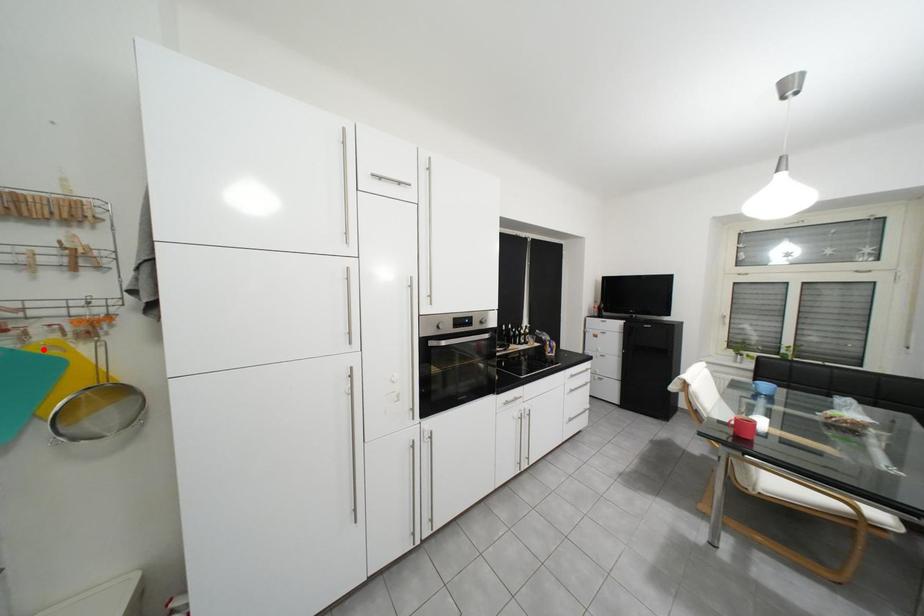
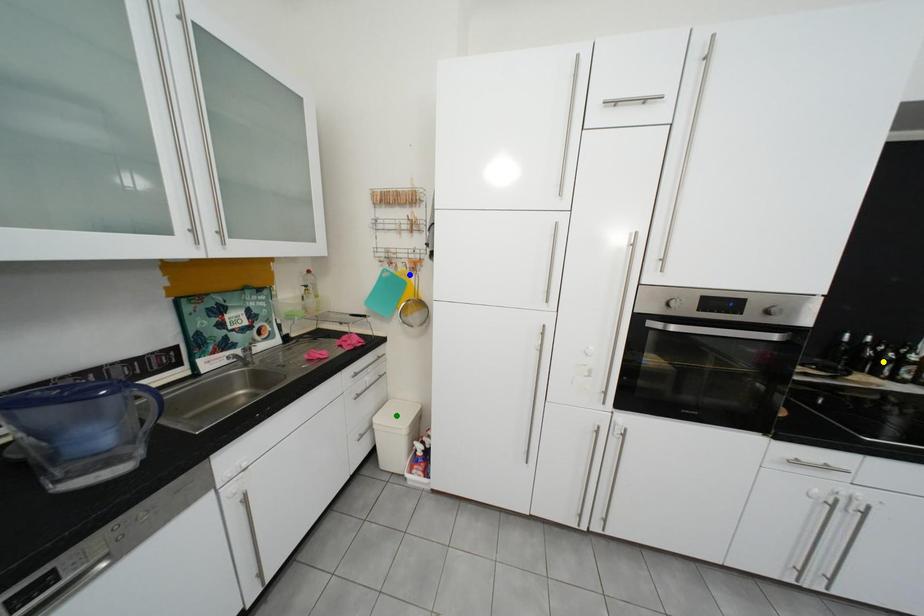
Question: I am providing you with two images of the same scene from different viewpoints. A red point is marked on the first image. You are given multiple points on the second image. In image 2, which mark is for the same physical point as the one in image 1?

Choices:
 (A) blue point
 (B) green point
 (C) yellow point

Answer: (A)